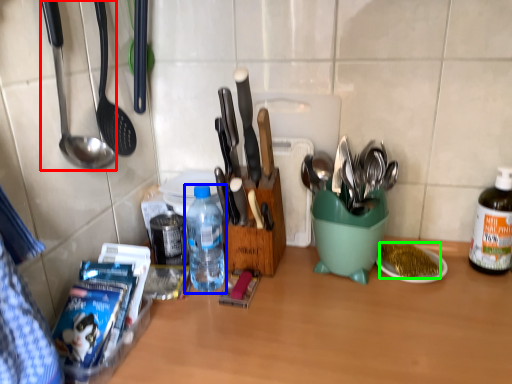
Question: Based on their relative distances, which object is nearer to spoon (highlighted by a red box)? Choose from bottle (highlighted by a blue box) and food (highlighted by a green box).

Choices:
 (A) bottle
 (B) food

Answer: (A)